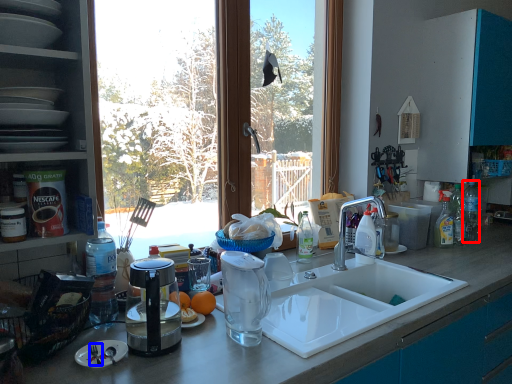
Question: Which of the following is the closest to the observer, bottle (highlighted by a red box) or silverware (highlighted by a blue box)?

Choices:
 (A) bottle
 (B) silverware

Answer: (B)